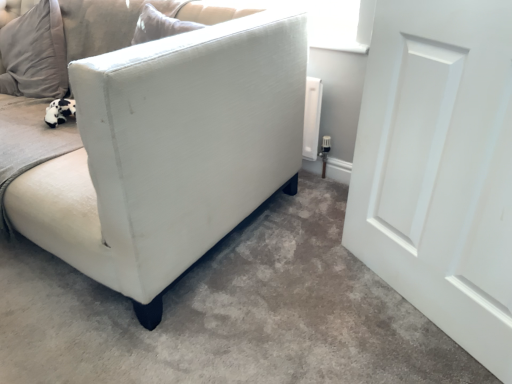
Question: In the image, is white fabric sofa at lower left positioned in front of or behind white fabric couch at left?

Choices:
 (A) front
 (B) behind

Answer: (A)

Question: From a real-world perspective, is white fabric sofa at lower left positioned above or below white fabric couch at left?

Choices:
 (A) below
 (B) above

Answer: (A)

Question: Which object is the farthest from the white matte door at right?

Choices:
 (A) white fabric couch at left
 (B) white fabric sofa at lower left

Answer: (A)

Question: Considering the real-world distances, which object is farthest from the white fabric sofa at lower left?

Choices:
 (A) white fabric couch at left
 (B) white matte door at right

Answer: (B)